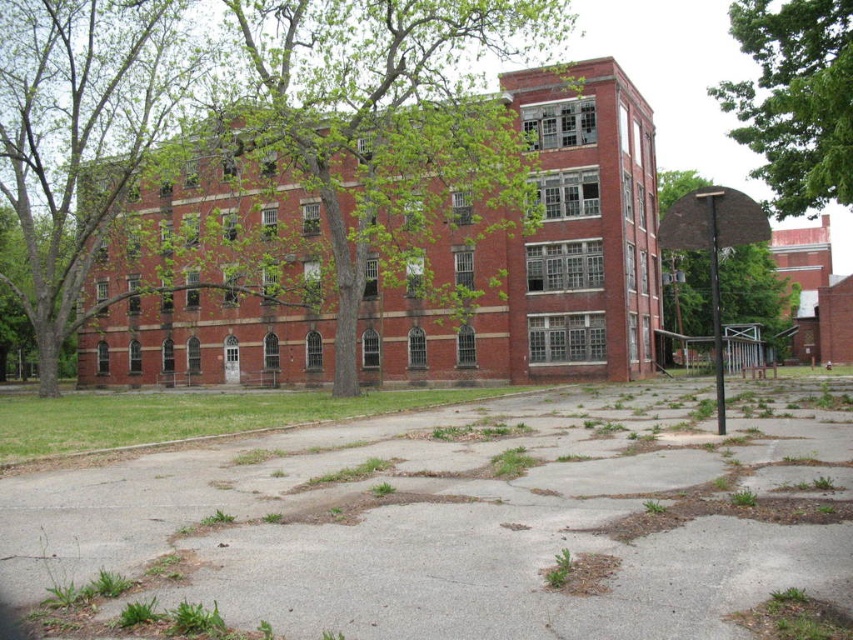
Does green leafy tree at upper center come in front of brown textured basketball hoop at center right?

No, green leafy tree at upper center is behind brown textured basketball hoop at center right.

Identify the location of green leafy tree at upper center. (793, 99).

This screenshot has width=853, height=640. I want to click on green leafy tree at upper center, so click(793, 99).